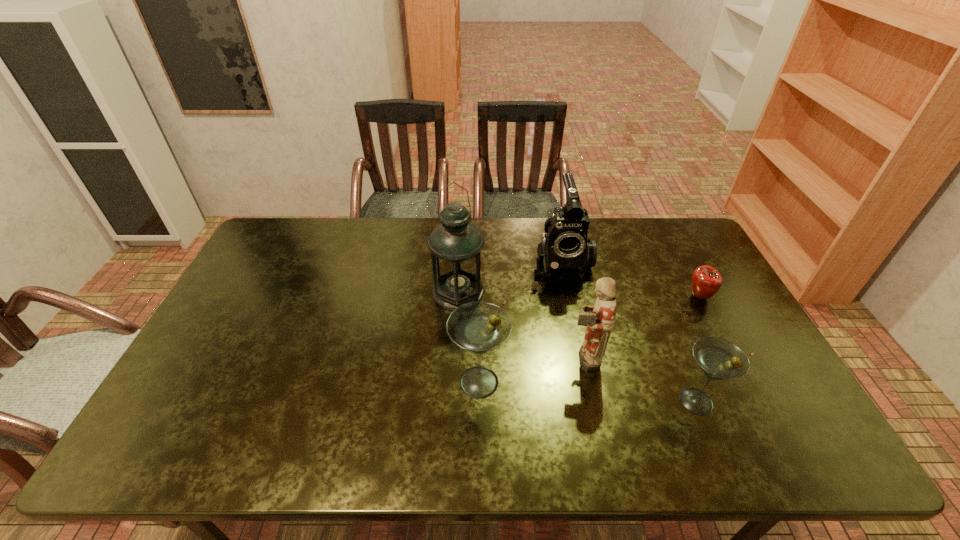
Where is `blank region between the oil lamp and the camcorder`? blank region between the oil lamp and the camcorder is located at coordinates (509, 278).

Identify which object is the nearest to the tallest object. Please provide its 2D coordinates. Your answer should be formatted as a tuple, i.e. [(x, y)], where the tuple contains the x and y coordinates of a point satisfying the conditions above.

[(566, 251)]

I want to click on the closest object to the left martini, so click(x=600, y=318).

Where is `vacant point that satisfies the following two spatial constraints: 1. on the lens mount of the camcorder; 2. on the right side of the shorter martini`? vacant point that satisfies the following two spatial constraints: 1. on the lens mount of the camcorder; 2. on the right side of the shorter martini is located at coordinates (588, 401).

This screenshot has height=540, width=960. In order to click on vacant position in the image that satisfies the following two spatial constraints: 1. on the lens mount of the right martini; 2. on the left side of the camcorder in this screenshot , I will do `click(588, 401)`.

Locate an element on the screen. blank area in the image that satisfies the following two spatial constraints: 1. on the front side of the left martini; 2. on the right side of the tallest object is located at coordinates (454, 382).

Find the location of a particular element. The image size is (960, 540). vacant space that satisfies the following two spatial constraints: 1. on the back side of the second shortest object; 2. on the right side of the rightmost object is located at coordinates (653, 296).

Image resolution: width=960 pixels, height=540 pixels. Find the location of `vacant space that satisfies the following two spatial constraints: 1. on the lens mount of the camcorder; 2. on the right side of the shorter martini`. vacant space that satisfies the following two spatial constraints: 1. on the lens mount of the camcorder; 2. on the right side of the shorter martini is located at coordinates [588, 401].

The image size is (960, 540). Find the location of `free space that satisfies the following two spatial constraints: 1. on the front side of the apple; 2. on the left side of the oil lamp`. free space that satisfies the following two spatial constraints: 1. on the front side of the apple; 2. on the left side of the oil lamp is located at coordinates (458, 296).

Locate an element on the screen. free space that satisfies the following two spatial constraints: 1. on the lens mount of the shortest object; 2. on the left side of the camcorder is located at coordinates (567, 296).